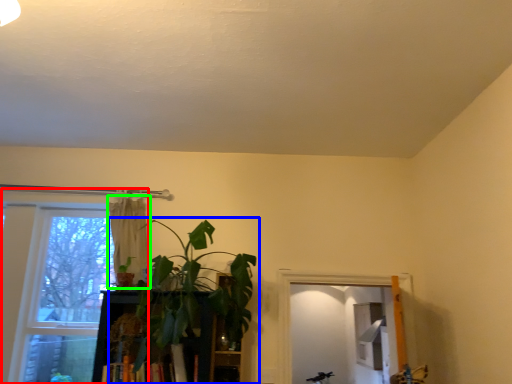
Question: Which object is positioned closest to window (highlighted by a red box)? Select from houseplant (highlighted by a blue box) and curtain (highlighted by a green box).

Choices:
 (A) houseplant
 (B) curtain

Answer: (B)